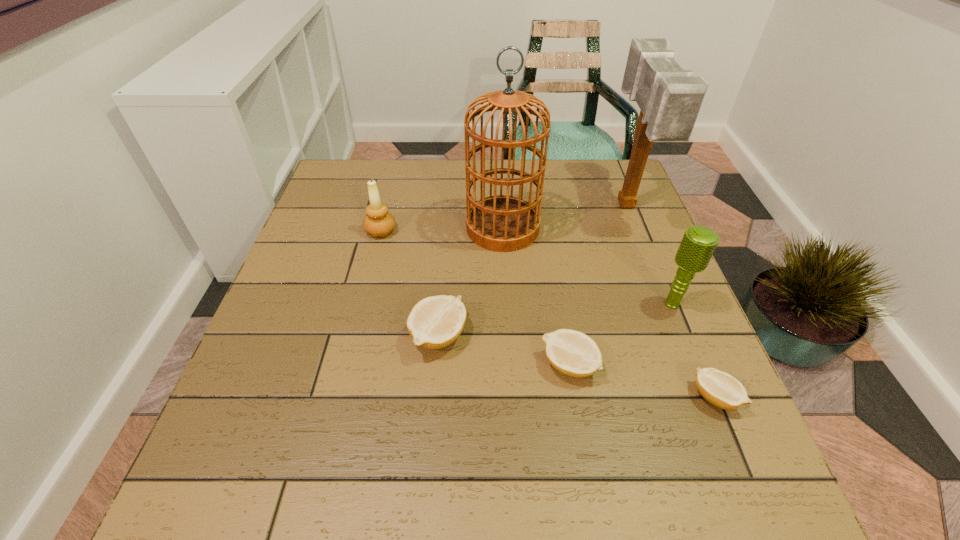
Please point out where to position a new lemon on the left to maintain spacing. Please provide its 2D coordinates. Your answer should be formatted as a tuple, i.e. [(x, y)], where the tuple contains the x and y coordinates of a point satisfying the conditions above.

[(322, 310)]